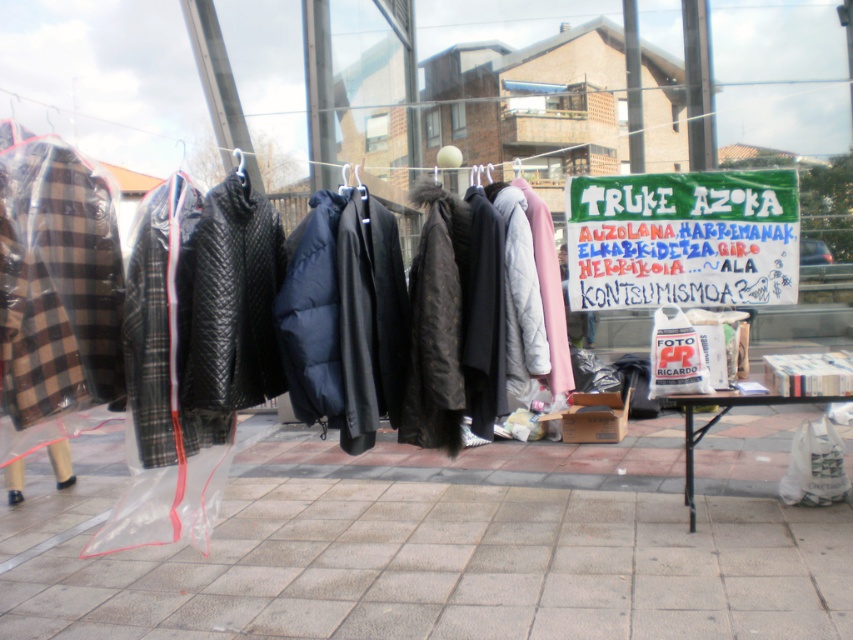
Question: Considering the real-world distances, which object is farthest from the white plastic table at lower right?

Choices:
 (A) green fabric sign at upper center
 (B) gray concrete pavement at lower center

Answer: (B)

Question: Is green fabric sign at upper center bigger than white plastic table at lower right?

Choices:
 (A) yes
 (B) no

Answer: (B)

Question: Observing the image, what is the correct spatial positioning of gray concrete pavement at lower center in reference to white plastic table at lower right?

Choices:
 (A) above
 (B) below

Answer: (B)

Question: Which object appears closest to the camera in this image?

Choices:
 (A) white plastic table at lower right
 (B) green fabric sign at upper center

Answer: (B)

Question: Which of the following is the closest to the observer?

Choices:
 (A) green fabric sign at upper center
 (B) white plastic table at lower right
 (C) gray concrete pavement at lower center

Answer: (C)

Question: Is gray concrete pavement at lower center wider than white plastic table at lower right?

Choices:
 (A) yes
 (B) no

Answer: (A)